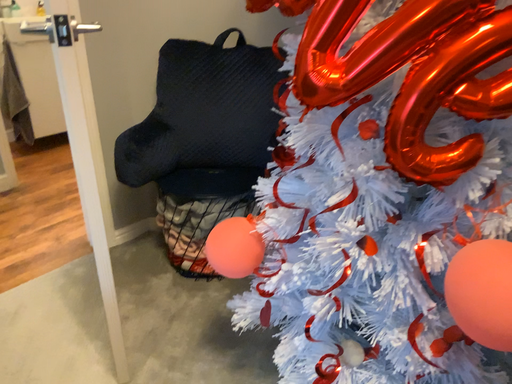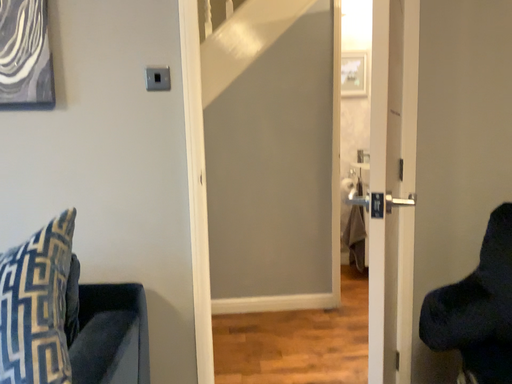
Question: Which way did the camera rotate in the video?

Choices:
 (A) rotated left
 (B) rotated right

Answer: (A)